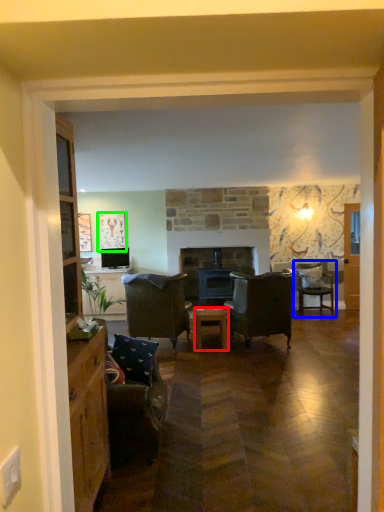
Question: Which object is positioned farthest from table (highlighted by a red box)? Select from chair (highlighted by a blue box) and picture frame (highlighted by a green box).

Choices:
 (A) chair
 (B) picture frame

Answer: (A)